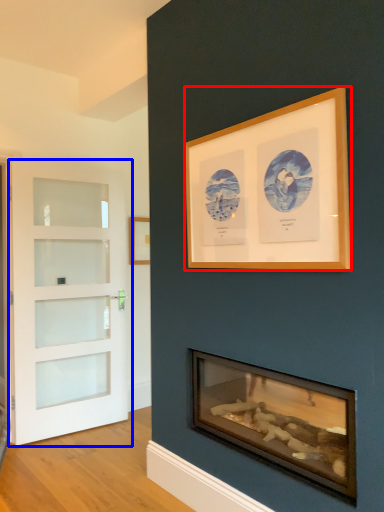
Question: Which point is closer to the camera, picture frame (highlighted by a red box) or door (highlighted by a blue box)?

Choices:
 (A) picture frame
 (B) door

Answer: (A)